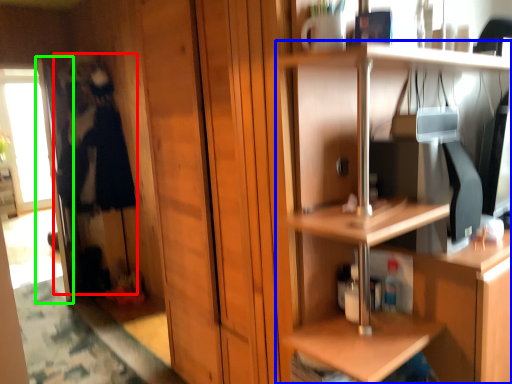
Question: Considering the real-world distances, which object is closest to person (highlighted by a red box)? shelf (highlighted by a blue box) or screen door (highlighted by a green box).

Choices:
 (A) shelf
 (B) screen door

Answer: (B)